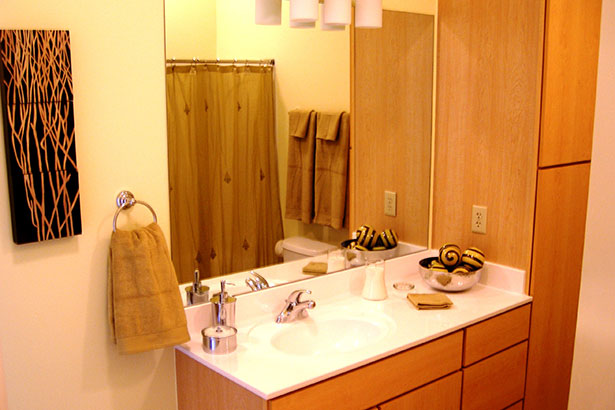
Where is `back splash`? The width and height of the screenshot is (615, 410). back splash is located at coordinates (502, 278), (403, 265), (330, 284), (245, 308).